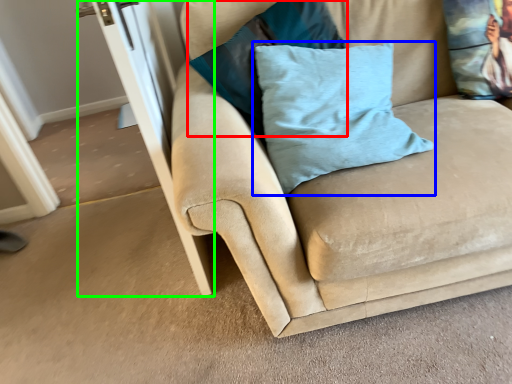
Question: Which object is the closest to the pillow (highlighted by a red box)? Choose among these: pillow (highlighted by a blue box) or screen door (highlighted by a green box).

Choices:
 (A) pillow
 (B) screen door

Answer: (A)